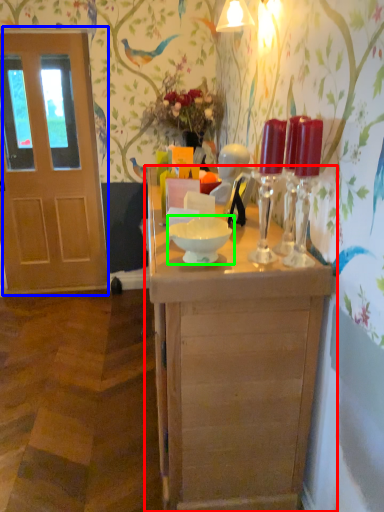
Question: Considering the real-world distances, which object is closest to table (highlighted by a red box)? door (highlighted by a blue box) or bowl (highlighted by a green box).

Choices:
 (A) door
 (B) bowl

Answer: (B)